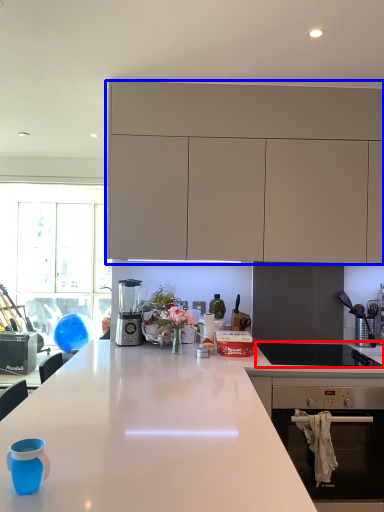
Question: Which object appears farthest to the camera in this image, gas stove (highlighted by a red box) or cabinetry (highlighted by a blue box)?

Choices:
 (A) gas stove
 (B) cabinetry

Answer: (B)